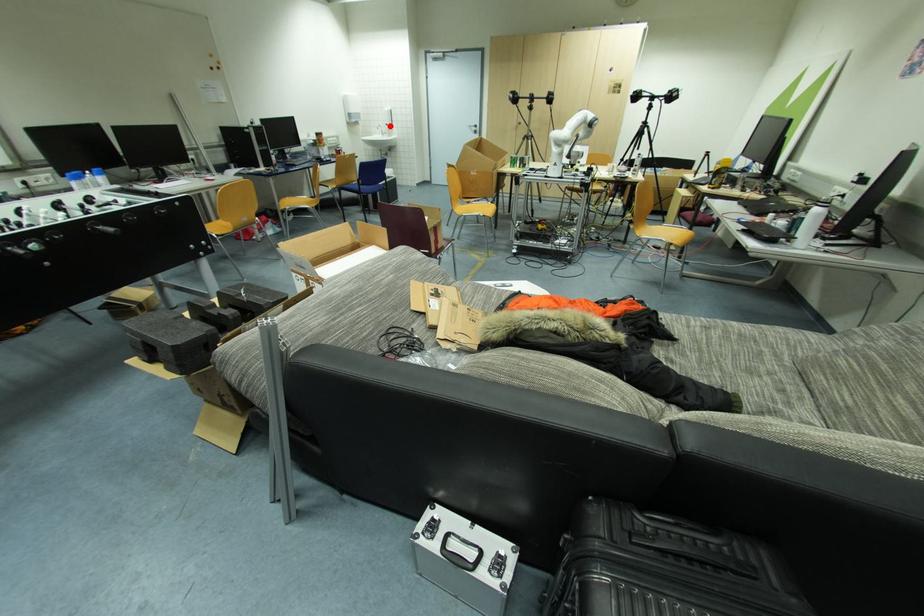
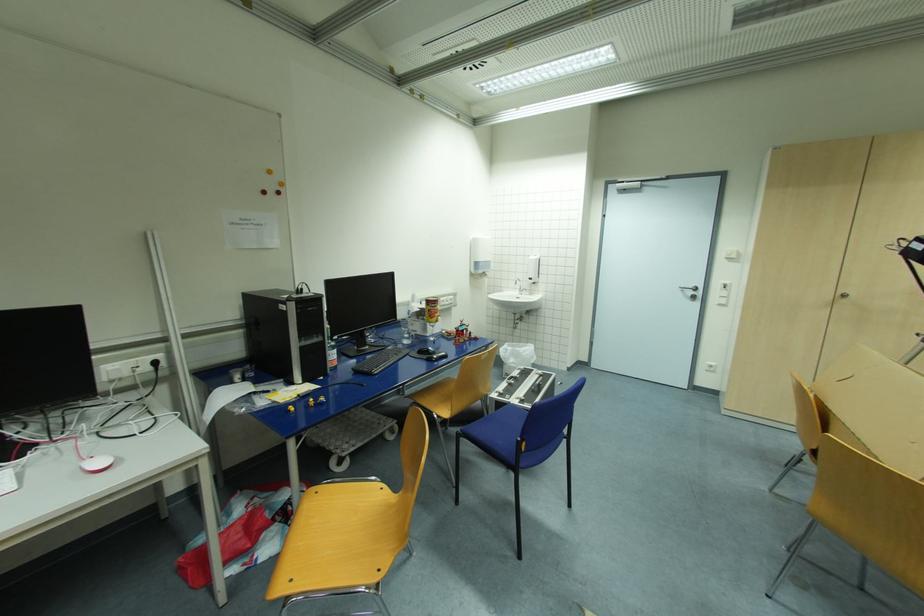
Question: I am providing you with two images of the same scene from different viewpoints. A red point is shown in image1. For the corresponding object point in image2, is it positioned nearer or farther from the camera?

Choices:
 (A) Nearer
 (B) Farther

Answer: (B)